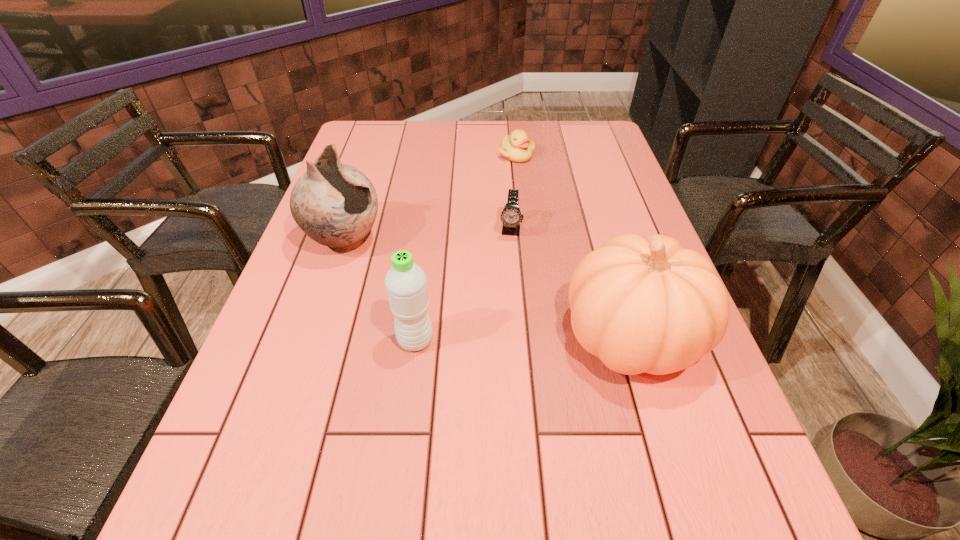
This screenshot has height=540, width=960. I want to click on free space on the desktop that is between the water bottle and the pumpkin and is positioned on the front-facing side of the shortest object, so click(x=527, y=338).

Identify the location of free spot on the desktop that is between the fourth object from right to left and the pumpkin and is positioned from the spout of the leftmost object. The height and width of the screenshot is (540, 960). (526, 338).

Identify the location of free space on the desktop that is between the fourth object from right to left and the pumpkin and is positioned on the face of the fourth tallest object. This screenshot has width=960, height=540. (497, 339).